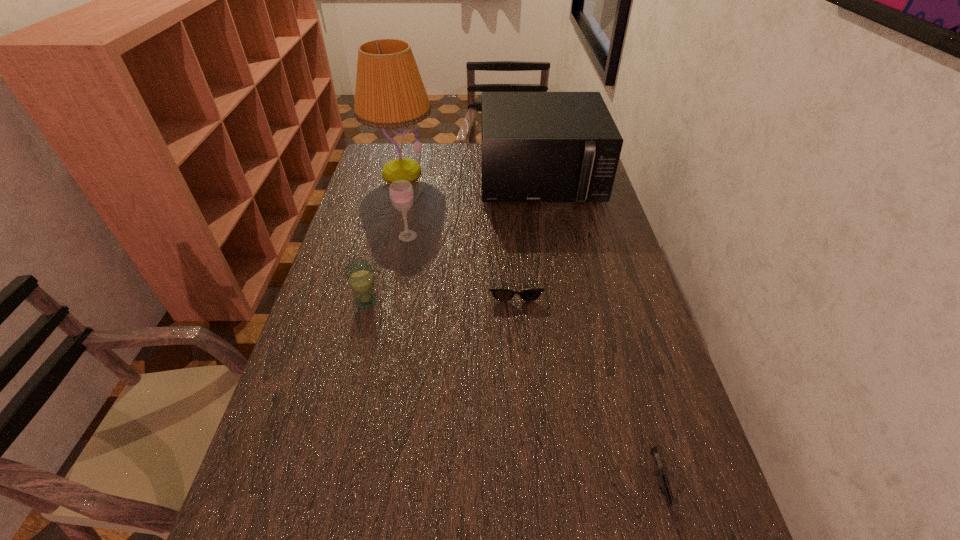
Locate an element on the screen. vacant area that lies between the glass and the lamp is located at coordinates (384, 237).

The width and height of the screenshot is (960, 540). In order to click on object that can be found as the second closest to the nearest object in this screenshot , I will do `click(359, 273)`.

Identify which object is the nearest to the sunglasses. Please provide its 2D coordinates. Your answer should be formatted as a tuple, i.e. [(x, y)], where the tuple contains the x and y coordinates of a point satisfying the conditions above.

[(401, 193)]

Image resolution: width=960 pixels, height=540 pixels. In order to click on free space that satisfies the following two spatial constraints: 1. on the side of the third tallest object near the pull switch; 2. on the left side of the lamp in this screenshot , I will do `click(386, 236)`.